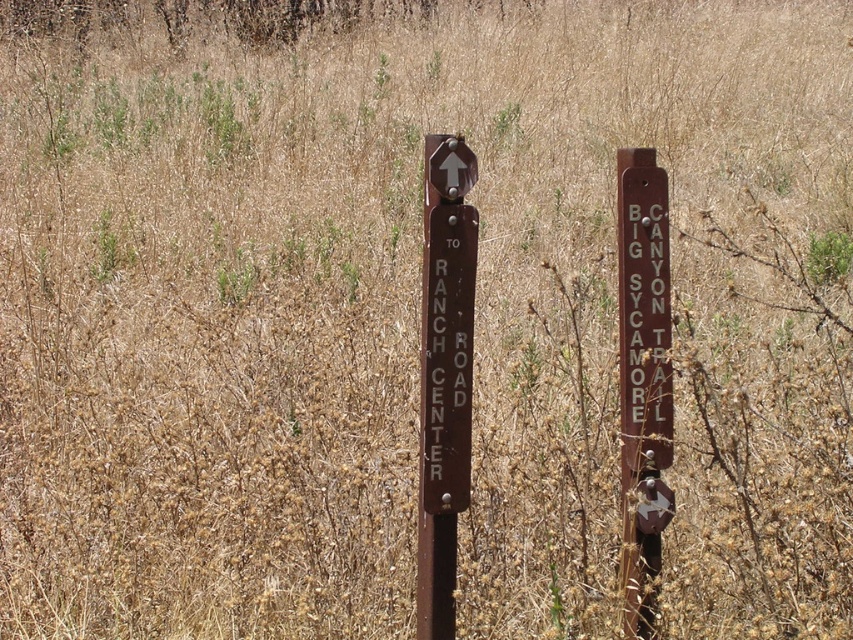
Question: Can you confirm if brown polished wood signpost at center is thinner than brown metal signpost at right?

Choices:
 (A) no
 (B) yes

Answer: (A)

Question: Can you confirm if brown polished wood signpost at center is positioned below brown metal signpost at right?

Choices:
 (A) no
 (B) yes

Answer: (B)

Question: Which object is farther from the camera taking this photo?

Choices:
 (A) brown polished wood signpost at center
 (B) brown metal signpost at right

Answer: (B)

Question: Can you confirm if brown polished wood signpost at center is positioned to the left of brown metal signpost at right?

Choices:
 (A) yes
 (B) no

Answer: (A)